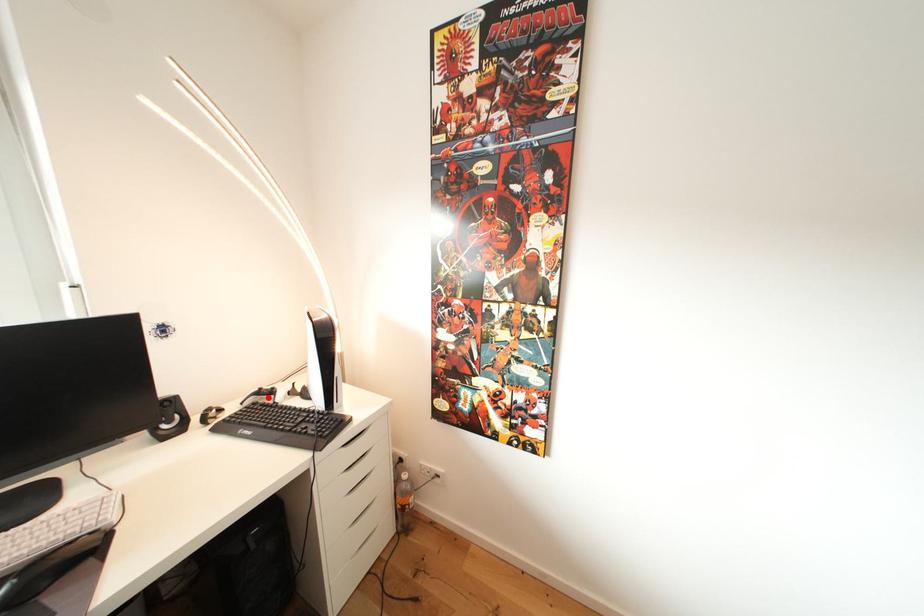
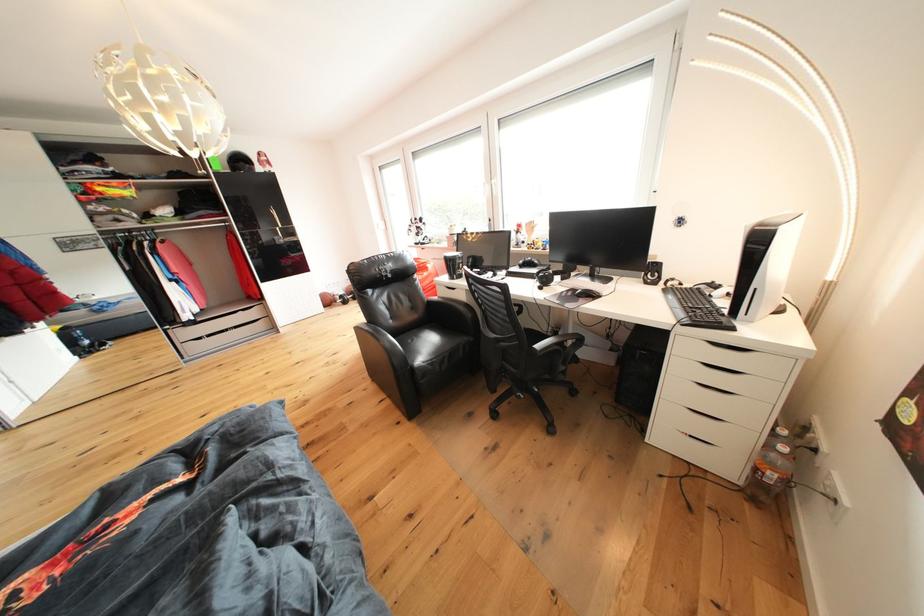
Question: I am providing you with two images of the same scene from different viewpoints. A red point is marked on the first image. At the location where the point appears in image 1, is it still visible in image 2?

Choices:
 (A) Yes
 (B) No

Answer: (B)